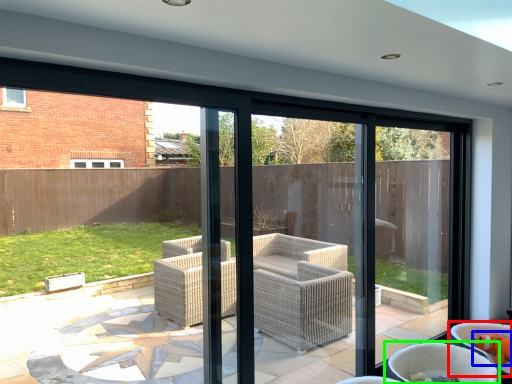
Question: Considering the real-world distances, which object is farthest from chair (highlighted by a red box)? toy (highlighted by a blue box) or chair (highlighted by a green box)?

Choices:
 (A) toy
 (B) chair

Answer: (B)